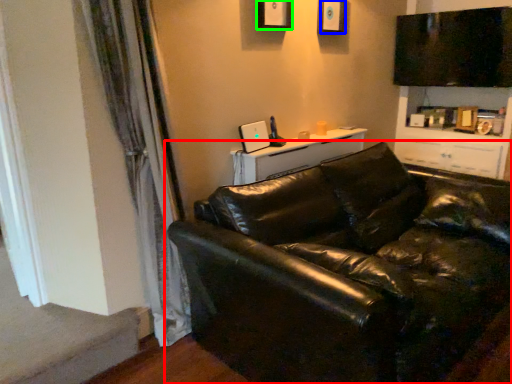
Question: Which object is the farthest from studio couch (highlighted by a red box)? Choose among these: picture frame (highlighted by a blue box) or picture frame (highlighted by a green box).

Choices:
 (A) picture frame
 (B) picture frame

Answer: (A)